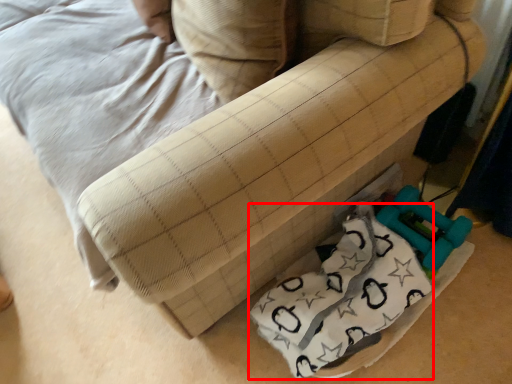
Question: From the image's perspective, what is the correct spatial positioning of material (annotated by the red box) in reference to pillow?

Choices:
 (A) above
 (B) below

Answer: (B)